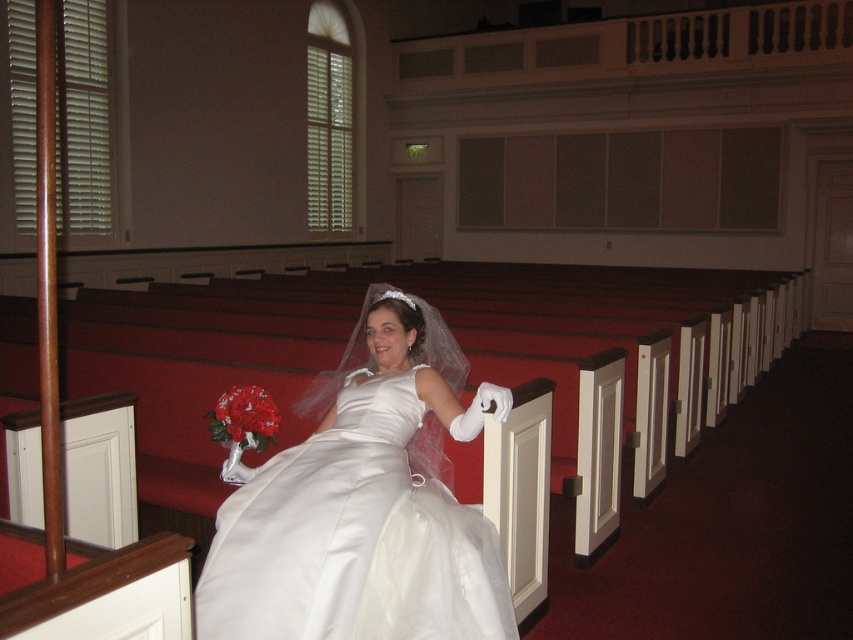
You are standing at the back of the church and see two points marked on the floor. The first point is labeled as point (409, 477) and the second is labeled as point (263, 404). Which point is closer to you?

Point (263, 404) is closer to you because it is behind point (409, 477).

In the scene shown: You are a photographer standing in front of the satin dress at center. You want to take a closeup shot of the dress without moving the dress. What is the minimum distance you need to move forward to get closer to the dress?

The satin dress at center and viewer are 2.04 meters apart from each other. To take a closeup shot without moving the dress, you need to move forward by the difference between the current distance and your desired closer distance. However, since the question asks for the minimum distance to move forward, it would be 0 meters if you can adjust your camera settings or lens instead of moving physically. If physical movement is required, you would need to move forward the exact distance you wish to reduce the 2

You are a photographer positioned at the front of the church, and you want to capture a photo of the bride. The satin dress at center and the red satin bouquet at center are both in your view. Which object is closer to you?

The satin dress at center is closer to the viewer than the red satin bouquet at center, so the satin dress at center is closer to you.